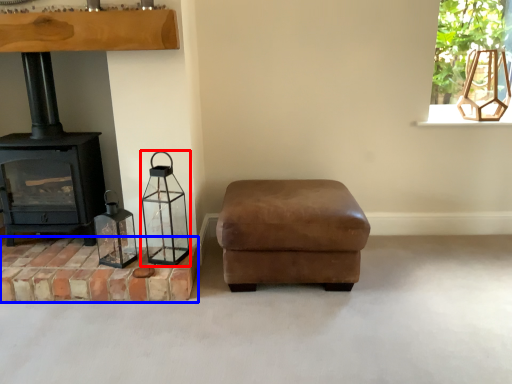
Question: Which of the following is the farthest to the observer, candle holder (highlighted by a red box) or brickwork (highlighted by a blue box)?

Choices:
 (A) candle holder
 (B) brickwork

Answer: (B)